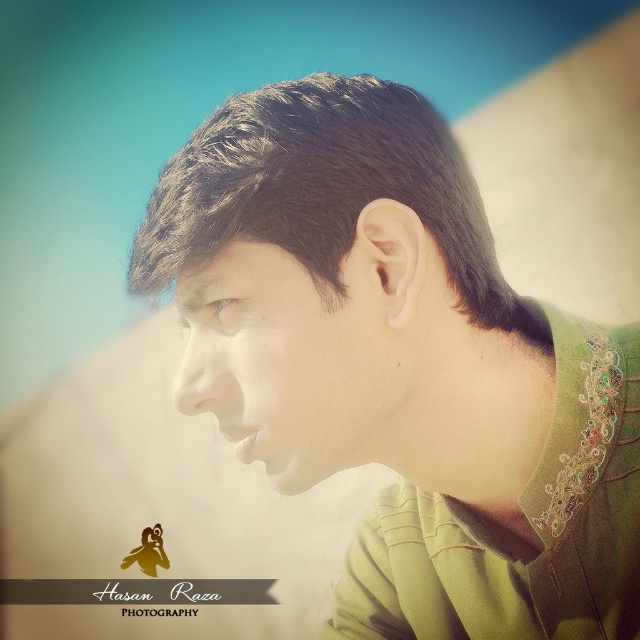
Question: Where is green embroidered shirt at center located in relation to smooth skin face at center in the image?

Choices:
 (A) below
 (B) above

Answer: (A)

Question: Among these objects, which one is nearest to the camera?

Choices:
 (A) smooth skin face at center
 (B) dark brown hair at center

Answer: (B)

Question: Which of the following is the closest to the observer?

Choices:
 (A) (289, 353)
 (B) (204, 148)

Answer: (A)

Question: Which object is farther from the camera taking this photo?

Choices:
 (A) smooth skin face at center
 (B) green embroidered shirt at center
 (C) dark brown hair at center

Answer: (A)

Question: Can you confirm if green embroidered shirt at center is positioned to the left of smooth skin face at center?

Choices:
 (A) yes
 (B) no

Answer: (B)

Question: Does green embroidered shirt at center lie in front of smooth skin face at center?

Choices:
 (A) no
 (B) yes

Answer: (B)